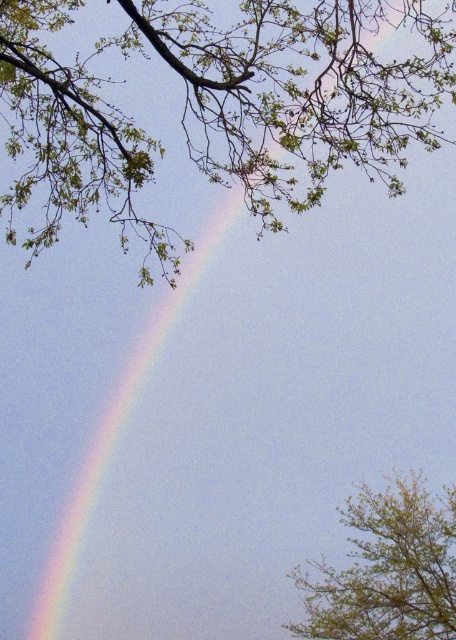
Question: Is green leafy branches at upper left above green leafy tree at upper right?

Choices:
 (A) no
 (B) yes

Answer: (B)

Question: Is green leafy branches at upper left to the left of green leafy tree at upper right from the viewer's perspective?

Choices:
 (A) yes
 (B) no

Answer: (A)

Question: Does green leafy branches at upper left appear over green leafy tree at upper right?

Choices:
 (A) yes
 (B) no

Answer: (A)

Question: Among these objects, which one is farthest from the camera?

Choices:
 (A) green leafy tree at upper right
 (B) green leafy branches at upper left

Answer: (A)

Question: Which point is farther to the camera?

Choices:
 (A) green leafy branches at upper left
 (B) green leafy tree at upper right

Answer: (B)

Question: Which object appears closest to the camera in this image?

Choices:
 (A) green leafy branches at upper left
 (B) green leafy tree at upper right

Answer: (A)